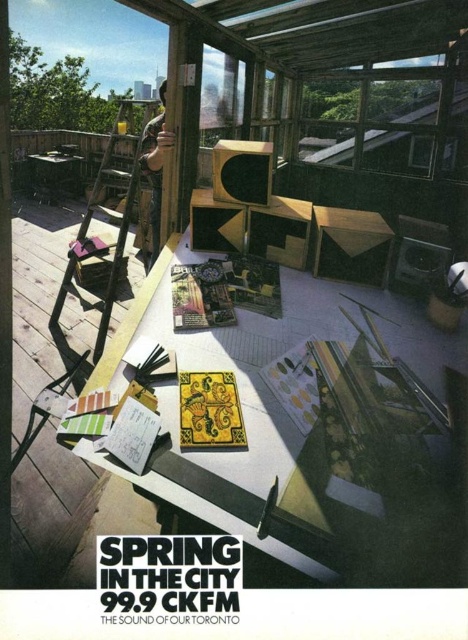
Is the position of wooden ladder at left less distant than that of matte black table at left?

Yes.

Who is more distant from viewer, [97,177] or [67,170]?

Positioned behind is point [67,170].

Find the location of a particular element. The height and width of the screenshot is (640, 468). wooden ladder at left is located at coordinates (117, 259).

Measure the distance between matte black table at left and wooden chair at lower left.

A distance of 5.76 meters exists between matte black table at left and wooden chair at lower left.

Is matte black table at left wider than wooden chair at lower left?

Indeed, matte black table at left has a greater width compared to wooden chair at lower left.

Where is `matte black table at left`? The height and width of the screenshot is (640, 468). matte black table at left is located at coordinates (55, 173).

At what (x,y) coordinates should I click in order to perform the action: click on matte black table at left. Please return your answer as a coordinate pair (x, y). The width and height of the screenshot is (468, 640). Looking at the image, I should click on (55, 173).

Where is `wooden deck at left`? The width and height of the screenshot is (468, 640). wooden deck at left is located at coordinates (42, 305).

Which is more to the right, wooden deck at left or matte black table at left?

wooden deck at left

Who is more forward, (23,328) or (65,163)?

Point (23,328) is more forward.

Where is `wooden deck at left`? This screenshot has height=640, width=468. wooden deck at left is located at coordinates (42, 305).